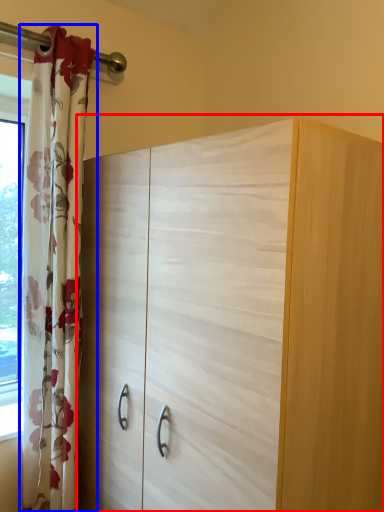
Question: Which object is further to the camera taking this photo, cupboard (highlighted by a red box) or curtain (highlighted by a blue box)?

Choices:
 (A) cupboard
 (B) curtain

Answer: (B)